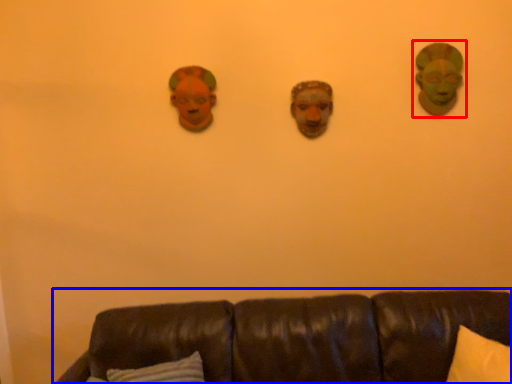
Question: Which object is closer to the camera taking this photo, person (highlighted by a red box) or studio couch (highlighted by a blue box)?

Choices:
 (A) person
 (B) studio couch

Answer: (B)